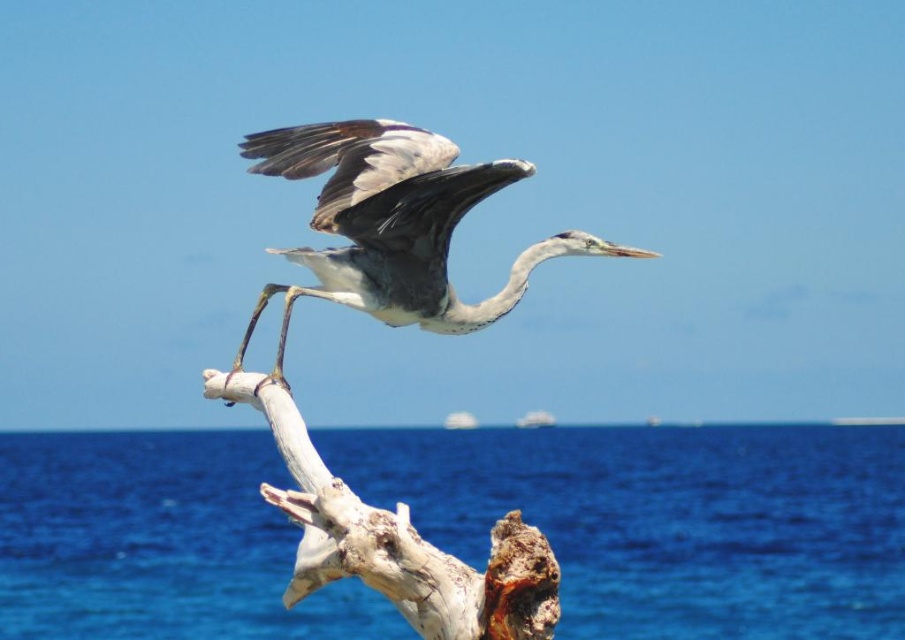
Does blue water at lower center have a lesser width compared to white rough wood at center?

Incorrect, blue water at lower center's width is not less than white rough wood at center's.

Is point (568, 445) farther from camera compared to point (461, 636)?

Yes, point (568, 445) is behind point (461, 636).

Is point (141, 550) positioned in front of point (240, 394)?

No, it is not.

Identify the location of blue water at lower center. The width and height of the screenshot is (905, 640). (667, 518).

The height and width of the screenshot is (640, 905). What are the coordinates of `blue water at lower center` in the screenshot? It's located at (667, 518).

Who is shorter, blue water at lower center or gray feathered heron at center?

gray feathered heron at center

Does point (627, 577) come behind point (375, 259)?

Yes, it is behind point (375, 259).

This screenshot has width=905, height=640. Identify the location of blue water at lower center. (667, 518).

Between gray feathered heron at center and white rough wood at center, which one is positioned higher?

gray feathered heron at center

This screenshot has width=905, height=640. Describe the element at coordinates (394, 225) in the screenshot. I see `gray feathered heron at center` at that location.

I want to click on gray feathered heron at center, so 394,225.